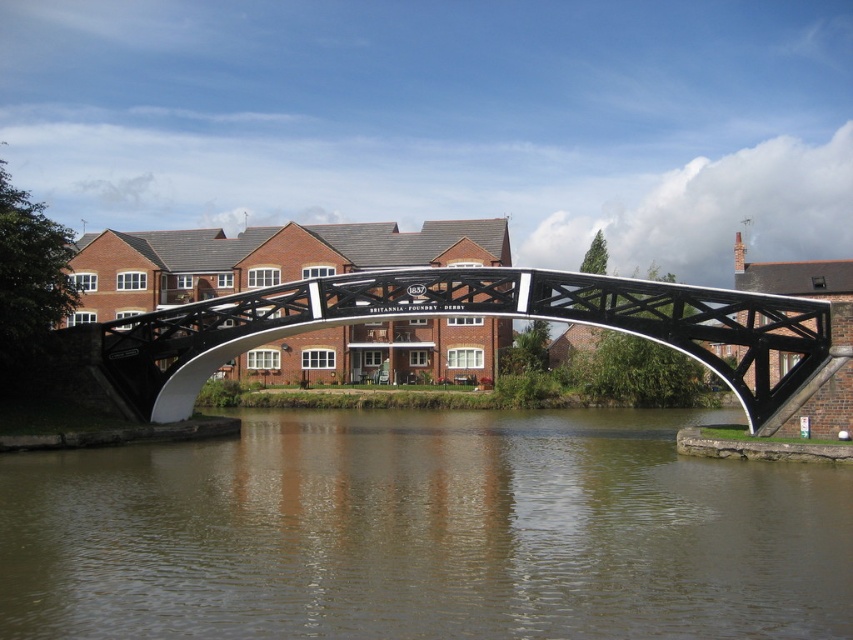
You are a photographer planning to capture the black metal pedestrian bridge at center and the brown murky water at center in a single shot. Based on their positions, which object should you position closer to the left side of your camera frame?

The brown murky water at center should be positioned closer to the left side of your camera frame since it is located to the left of the black metal pedestrian bridge at center.

You are a drone operator trying to capture a photo of the arched pedestrian bridge. To ensure the brown murky water at center is centered in the photo, what coordinate should you aim for?

The brown murky water at center is located at coordinate point (425, 532), so you should aim for that coordinate to center it in the photo.